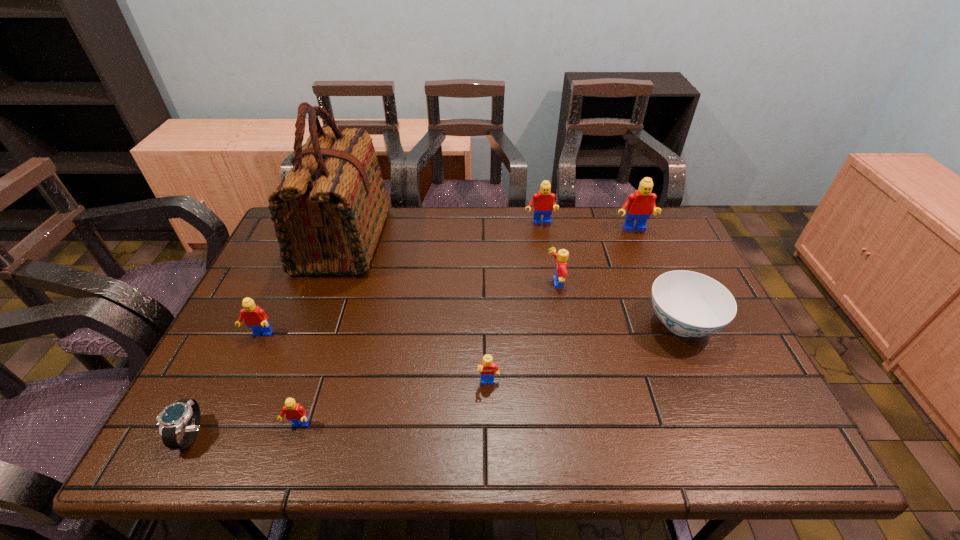
The height and width of the screenshot is (540, 960). In order to click on watch present at the left edge in this screenshot , I will do `click(171, 420)`.

Image resolution: width=960 pixels, height=540 pixels. Find the location of `Lego located in the right edge section of the desktop`. Lego located in the right edge section of the desktop is located at coordinates (639, 204).

What are the coordinates of `chinaware that is at the right edge` in the screenshot? It's located at (690, 304).

I want to click on object at the far left corner, so click(328, 212).

The image size is (960, 540). Find the location of `object situated at the near left corner`. object situated at the near left corner is located at coordinates (171, 420).

Find the location of a particular element. object located in the far right corner section of the desktop is located at coordinates (639, 204).

Identify the location of free region at the far edge of the desktop. (436, 235).

In the image, there is a desktop. Where is `blank space at the near edge`? blank space at the near edge is located at coordinates (685, 423).

This screenshot has height=540, width=960. What are the coordinates of `vacant area at the left edge` in the screenshot? It's located at (303, 280).

This screenshot has height=540, width=960. In the image, there is a desktop. What are the coordinates of `free region at the right edge` in the screenshot? It's located at (682, 354).